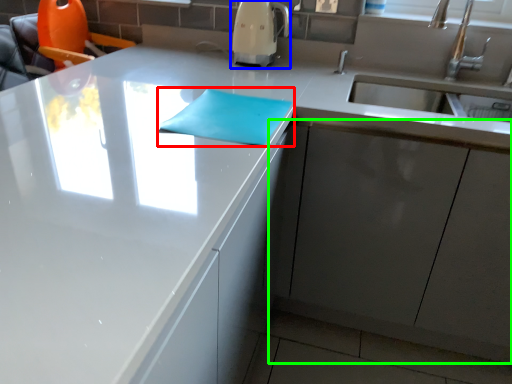
Question: Which object is positioned farthest from notepad (highlighted by a red box)? Select from coffee machine (highlighted by a blue box) and cabinetry (highlighted by a green box).

Choices:
 (A) coffee machine
 (B) cabinetry

Answer: (A)